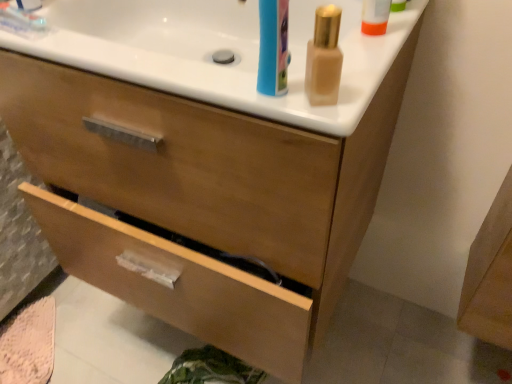
Question: Considering the relative sizes of wooden drawer at lower center, the first drawer when ordered from bottom to top, and white glossy counter top at upper center in the image provided, is wooden drawer at lower center, the first drawer when ordered from bottom to top, smaller than white glossy counter top at upper center?

Choices:
 (A) no
 (B) yes

Answer: (B)

Question: Does wooden drawer at lower center, the first drawer when ordered from bottom to top, lie in front of white glossy counter top at upper center?

Choices:
 (A) no
 (B) yes

Answer: (A)

Question: Is wooden drawer at lower center, the first drawer when ordered from bottom to top, thinner than white glossy counter top at upper center?

Choices:
 (A) yes
 (B) no

Answer: (B)

Question: Is wooden drawer at lower center, the first drawer when ordered from bottom to top, taller than white glossy counter top at upper center?

Choices:
 (A) no
 (B) yes

Answer: (A)

Question: Is wooden drawer at lower center, which ranks as the 2th drawer in top-to-bottom order, oriented away from white glossy counter top at upper center?

Choices:
 (A) no
 (B) yes

Answer: (A)

Question: From their relative heights in the image, would you say wooden drawer at lower center, which ranks as the 2th drawer in top-to-bottom order, is taller or shorter than white glossy counter top at upper center?

Choices:
 (A) tall
 (B) short

Answer: (B)

Question: Is wooden drawer at lower center, which ranks as the 2th drawer in top-to-bottom order, in front of or behind white glossy counter top at upper center in the image?

Choices:
 (A) behind
 (B) front

Answer: (A)

Question: Is point (89, 243) positioned closer to the camera than point (339, 130)?

Choices:
 (A) farther
 (B) closer

Answer: (A)

Question: Would you say wooden drawer at lower center, which ranks as the 2th drawer in top-to-bottom order, is inside or outside white glossy counter top at upper center?

Choices:
 (A) outside
 (B) inside

Answer: (A)

Question: Does point (320, 29) appear closer or farther from the camera than point (240, 286)?

Choices:
 (A) farther
 (B) closer

Answer: (B)

Question: Looking at the image, does satin gold bottle at upper right seem bigger or smaller compared to wooden drawer at lower center, the first drawer when ordered from bottom to top?

Choices:
 (A) big
 (B) small

Answer: (B)

Question: From the image's perspective, is satin gold bottle at upper right positioned above or below wooden drawer at lower center, which ranks as the 2th drawer in top-to-bottom order?

Choices:
 (A) above
 (B) below

Answer: (A)

Question: Is satin gold bottle at upper right taller or shorter than wooden drawer at lower center, which ranks as the 2th drawer in top-to-bottom order?

Choices:
 (A) tall
 (B) short

Answer: (A)

Question: From a real-world perspective, is satin gold bottle at upper right positioned above or below white glossy counter top at upper center?

Choices:
 (A) above
 (B) below

Answer: (A)

Question: From their relative heights in the image, would you say satin gold bottle at upper right is taller or shorter than white glossy counter top at upper center?

Choices:
 (A) short
 (B) tall

Answer: (A)